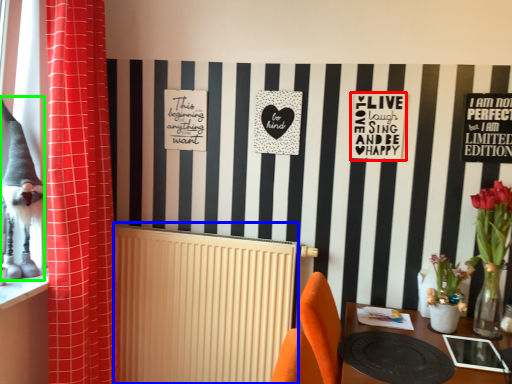
Question: Considering the real-world distances, which object is closest to postcard (highlighted by a red box)? radiator (highlighted by a blue box) or animal (highlighted by a green box).

Choices:
 (A) radiator
 (B) animal

Answer: (A)